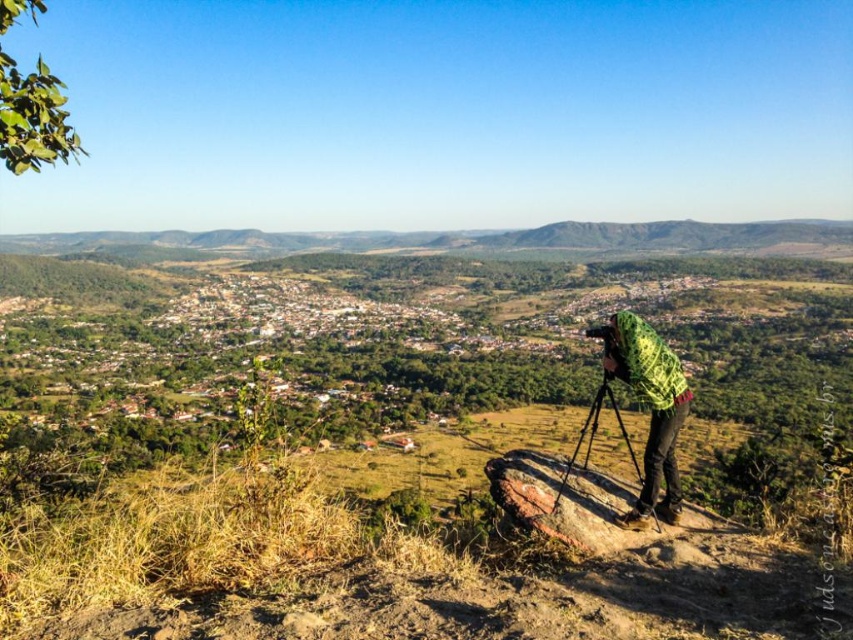
Question: Among these objects, which one is farthest from the camera?

Choices:
 (A) metallic tripod at center
 (B) green knitted sweater at center

Answer: (B)

Question: Can you confirm if green knitted sweater at center is positioned above metallic tripod at center?

Choices:
 (A) yes
 (B) no

Answer: (A)

Question: Which object is closer to the camera taking this photo?

Choices:
 (A) green knitted sweater at center
 (B) metallic tripod at center

Answer: (B)

Question: Does green knitted sweater at center lie behind metallic tripod at center?

Choices:
 (A) yes
 (B) no

Answer: (A)

Question: Is green knitted sweater at center above metallic tripod at center?

Choices:
 (A) no
 (B) yes

Answer: (B)